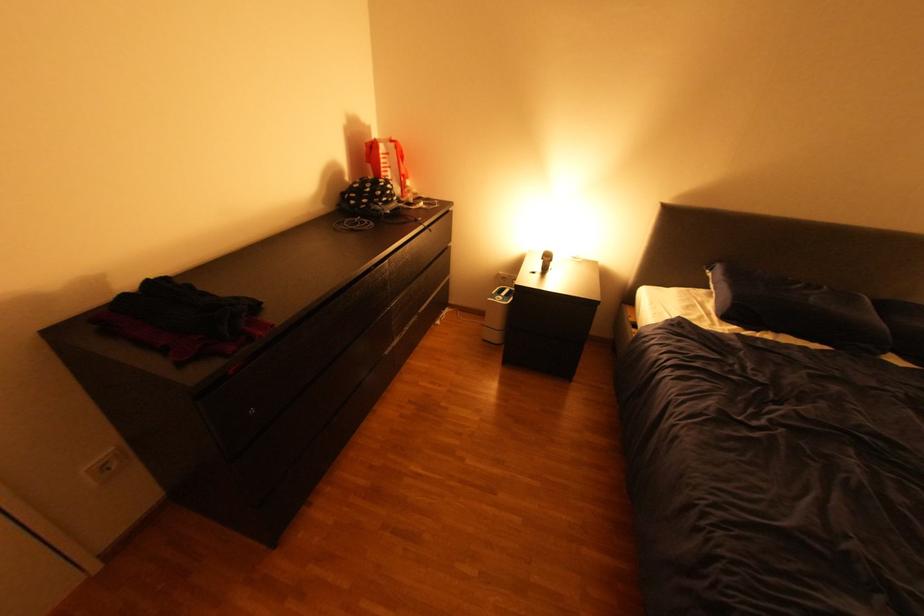
The height and width of the screenshot is (616, 924). What do you see at coordinates (104, 464) in the screenshot? I see `the white power socket` at bounding box center [104, 464].